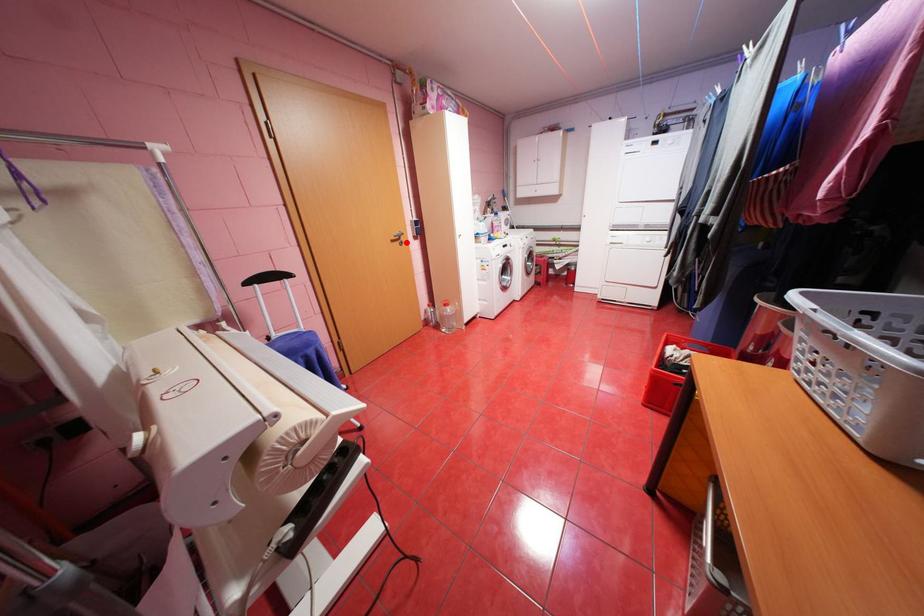
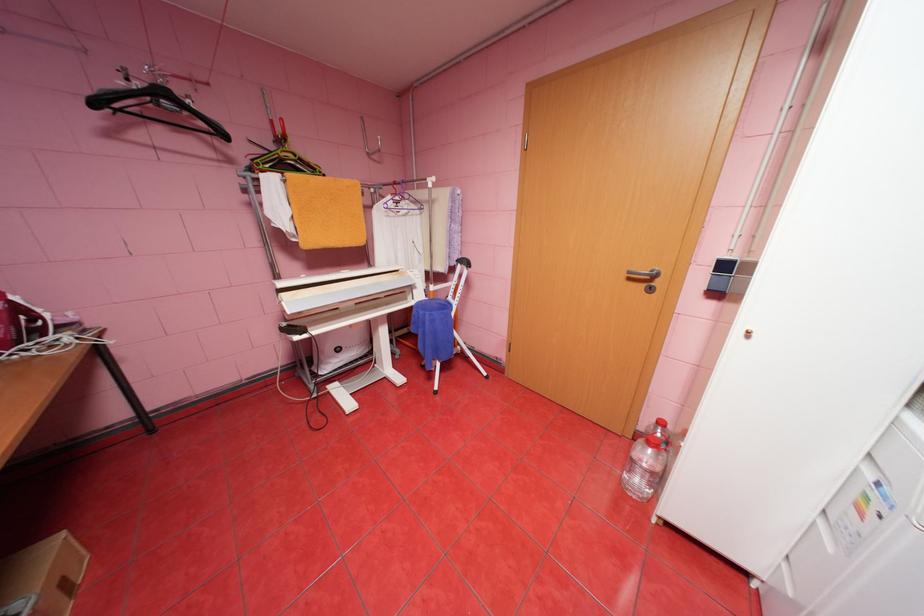
Question: A red point is marked in image1. In image2, is the corresponding 3D point closer to the camera or farther? Reply with the corresponding letter.

Choices:
 (A) The corresponding 3D point is closer.
 (B) The corresponding 3D point is farther.

Answer: (B)